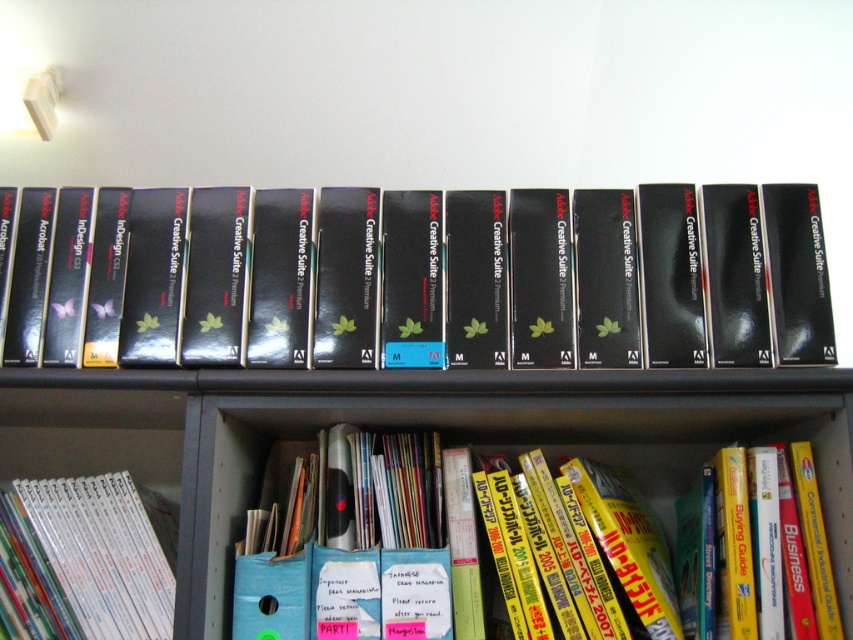
You are a librarian who needs to place a new book that is 35 centimeters wide. You see the yellow glossy book at lower center and the white glossy book at lower left. Can the new book fit in the space between them?

The distance between the yellow glossy book at lower center and the white glossy book at lower left is 34.72 centimeters. Since the new book is 35 centimeters wide, it is slightly wider than the available space. Therefore, the new book cannot fit between them.

You are organizing a bookshelf and need to place a new item between the black matte adobe creative suite premium at center and the yellow glossy book at lower center. The new item is 15 centimeters wide. Is there enough space between them for the new item?

The distance between the black matte adobe creative suite premium at center and the yellow glossy book at lower center is 25.85 centimeters. Since the new item is 15 centimeters wide, there is sufficient space to place it between them.